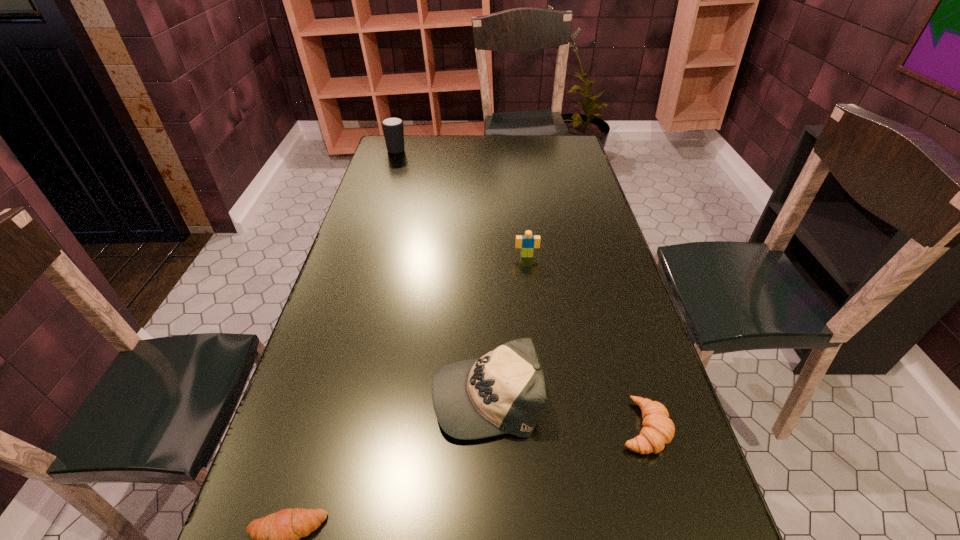
This screenshot has height=540, width=960. I want to click on mug, so click(393, 129).

You are a GUI agent. You are given a task and a screenshot of the screen. Output one action in this format:
    pyautogui.click(x=<x>, y=<y>)
    Task: Click on the tallest object
    
    Given the screenshot: What is the action you would take?
    pyautogui.click(x=393, y=129)

Image resolution: width=960 pixels, height=540 pixels. I want to click on baseball cap, so click(504, 392).

Find the location of `Lego`. Lego is located at coordinates (527, 242).

The height and width of the screenshot is (540, 960). What are the coordinates of `the taller crescent roll` in the screenshot? It's located at (658, 430).

Find the location of `the rightmost object`. the rightmost object is located at coordinates (658, 430).

Where is `vacant region located on the front-facing side of the baseball cap`? vacant region located on the front-facing side of the baseball cap is located at coordinates (313, 394).

The height and width of the screenshot is (540, 960). What are the coordinates of `free location located on the front-facing side of the baseball cap` in the screenshot? It's located at (387, 394).

Image resolution: width=960 pixels, height=540 pixels. I want to click on vacant area located on the front-facing side of the baseball cap, so click(x=349, y=394).

Locate an element on the screen. The height and width of the screenshot is (540, 960). vacant region located 0.210m on the face of the fourth nearest object is located at coordinates (533, 309).